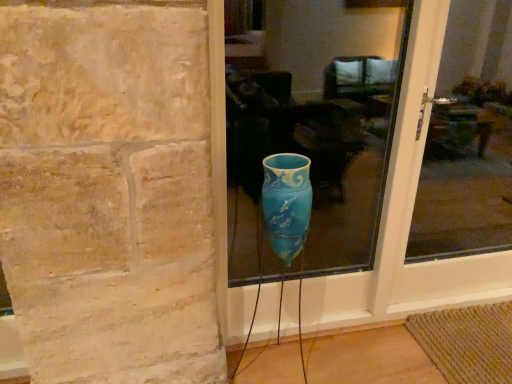
Where is `blue glass vase at center, marked as the 2th glass window in a right-to-left arrangement`? The width and height of the screenshot is (512, 384). blue glass vase at center, marked as the 2th glass window in a right-to-left arrangement is located at coordinates (312, 123).

What do you see at coordinates (312, 123) in the screenshot? The image size is (512, 384). I see `blue glass vase at center, the first glass window positioned from the left` at bounding box center [312, 123].

The width and height of the screenshot is (512, 384). Describe the element at coordinates (468, 139) in the screenshot. I see `transparent glass door at center, the 2th glass window from the left` at that location.

Locate an element on the screen. transparent glass door at center, the 1th glass window when ordered from right to left is located at coordinates (468, 139).

You are a GUI agent. You are given a task and a screenshot of the screen. Output one action in this format:
    pyautogui.click(x=<x>, y=<y>)
    Task: Click on the blue glass vase at center, the first glass window positioned from the left
    
    Given the screenshot: What is the action you would take?
    [x=312, y=123]

Is transparent glass door at center, the 1th glass window when ordered from right to left, to the right of blue glass vase at center, marked as the 2th glass window in a right-to-left arrangement, from the viewer's perspective?

Yes.

Considering their positions, is transparent glass door at center, the 1th glass window when ordered from right to left, located in front of or behind blue glass vase at center, the first glass window positioned from the left?

transparent glass door at center, the 1th glass window when ordered from right to left, is positioned farther from the viewer than blue glass vase at center, the first glass window positioned from the left.

Does point (471, 147) come behind point (226, 15)?

Yes, point (471, 147) is behind point (226, 15).

From the image's perspective, is transparent glass door at center, the 2th glass window from the left, below blue glass vase at center, marked as the 2th glass window in a right-to-left arrangement?

Correct, transparent glass door at center, the 2th glass window from the left, appears lower than blue glass vase at center, marked as the 2th glass window in a right-to-left arrangement, in the image.

From a real-world perspective, which is physically above, transparent glass door at center, the 1th glass window when ordered from right to left, or blue glass vase at center, the first glass window positioned from the left?

blue glass vase at center, the first glass window positioned from the left.

Does transparent glass door at center, the 1th glass window when ordered from right to left, have a greater width compared to blue glass vase at center, marked as the 2th glass window in a right-to-left arrangement?

No, transparent glass door at center, the 1th glass window when ordered from right to left, is not wider than blue glass vase at center, marked as the 2th glass window in a right-to-left arrangement.

Who is shorter, transparent glass door at center, the 2th glass window from the left, or blue glass vase at center, the first glass window positioned from the left?

blue glass vase at center, the first glass window positioned from the left, is shorter.

Which of these two, transparent glass door at center, the 1th glass window when ordered from right to left, or blue glass vase at center, marked as the 2th glass window in a right-to-left arrangement, is bigger?

transparent glass door at center, the 1th glass window when ordered from right to left.

Is transparent glass door at center, the 1th glass window when ordered from right to left, inside or outside of blue glass vase at center, the first glass window positioned from the left?

The correct answer is: outside.

In the scene shown: Are transparent glass door at center, the 1th glass window when ordered from right to left, and blue glass vase at center, the first glass window positioned from the left, beside each other?

transparent glass door at center, the 1th glass window when ordered from right to left, and blue glass vase at center, the first glass window positioned from the left, are not in contact.

Is transparent glass door at center, the 2th glass window from the left, oriented towards blue glass vase at center, marked as the 2th glass window in a right-to-left arrangement?

No, transparent glass door at center, the 2th glass window from the left, does not turn towards blue glass vase at center, marked as the 2th glass window in a right-to-left arrangement.

Consider the image. Can you tell me how much transparent glass door at center, the 2th glass window from the left, and blue glass vase at center, marked as the 2th glass window in a right-to-left arrangement, differ in facing direction?

The angular difference between transparent glass door at center, the 2th glass window from the left, and blue glass vase at center, marked as the 2th glass window in a right-to-left arrangement, is 0.00187 degrees.

How far apart are transparent glass door at center, the 1th glass window when ordered from right to left, and blue glass vase at center, the first glass window positioned from the left?

transparent glass door at center, the 1th glass window when ordered from right to left, is 37.97 inches away from blue glass vase at center, the first glass window positioned from the left.

Where is `glass window above the transparent glass door at center, the 2th glass window from the left (from the image's perspective)`? This screenshot has width=512, height=384. glass window above the transparent glass door at center, the 2th glass window from the left (from the image's perspective) is located at coordinates (312, 123).

In the image, is blue glass vase at center, the first glass window positioned from the left, on the left side or the right side of transparent glass door at center, the 1th glass window when ordered from right to left?

In the image, blue glass vase at center, the first glass window positioned from the left, appears on the left side of transparent glass door at center, the 1th glass window when ordered from right to left.

Considering their positions, is blue glass vase at center, the first glass window positioned from the left, located in front of or behind transparent glass door at center, the 1th glass window when ordered from right to left?

blue glass vase at center, the first glass window positioned from the left, is in front of transparent glass door at center, the 1th glass window when ordered from right to left.

Does point (279, 146) appear closer or farther from the camera than point (443, 51)?

Point (279, 146) appears to be closer to the viewer than point (443, 51).

From the image's perspective, is blue glass vase at center, marked as the 2th glass window in a right-to-left arrangement, above or below transparent glass door at center, the 2th glass window from the left?

blue glass vase at center, marked as the 2th glass window in a right-to-left arrangement, is situated higher than transparent glass door at center, the 2th glass window from the left, in the image.

From a real-world perspective, is blue glass vase at center, marked as the 2th glass window in a right-to-left arrangement, below transparent glass door at center, the 1th glass window when ordered from right to left?

No, from a real-world perspective, blue glass vase at center, marked as the 2th glass window in a right-to-left arrangement, is not under transparent glass door at center, the 1th glass window when ordered from right to left.

Is blue glass vase at center, the first glass window positioned from the left, thinner than transparent glass door at center, the 2th glass window from the left?

Incorrect, the width of blue glass vase at center, the first glass window positioned from the left, is not less than that of transparent glass door at center, the 2th glass window from the left.

Which of these two, blue glass vase at center, the first glass window positioned from the left, or transparent glass door at center, the 2th glass window from the left, stands taller?

transparent glass door at center, the 2th glass window from the left, is taller.

Which of these two, blue glass vase at center, the first glass window positioned from the left, or transparent glass door at center, the 1th glass window when ordered from right to left, is smaller?

blue glass vase at center, the first glass window positioned from the left.

Is blue glass vase at center, marked as the 2th glass window in a right-to-left arrangement, inside or outside of transparent glass door at center, the 1th glass window when ordered from right to left?

blue glass vase at center, marked as the 2th glass window in a right-to-left arrangement, is not inside transparent glass door at center, the 1th glass window when ordered from right to left, it's outside.

Is blue glass vase at center, marked as the 2th glass window in a right-to-left arrangement, with transparent glass door at center, the 2th glass window from the left?

No, blue glass vase at center, marked as the 2th glass window in a right-to-left arrangement, is not with transparent glass door at center, the 2th glass window from the left.

Is transparent glass door at center, the 1th glass window when ordered from right to left, at the back of blue glass vase at center, the first glass window positioned from the left?

No.

Find the location of a particular element. glass window below the blue glass vase at center, marked as the 2th glass window in a right-to-left arrangement (from a real-world perspective) is located at coordinates (468, 139).

Locate an element on the screen. The height and width of the screenshot is (384, 512). glass window below the blue glass vase at center, marked as the 2th glass window in a right-to-left arrangement (from a real-world perspective) is located at coordinates (468, 139).

You are a GUI agent. You are given a task and a screenshot of the screen. Output one action in this format:
    pyautogui.click(x=<x>, y=<y>)
    Task: Click on the glass window below the blue glass vase at center, the first glass window positioned from the left (from the image's perspective)
    The width and height of the screenshot is (512, 384).
    Given the screenshot: What is the action you would take?
    pyautogui.click(x=468, y=139)